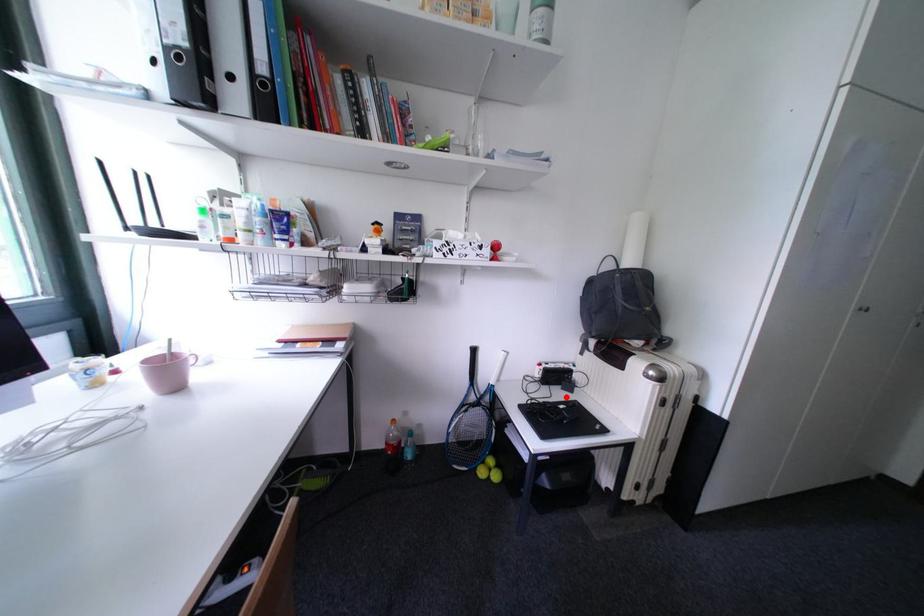
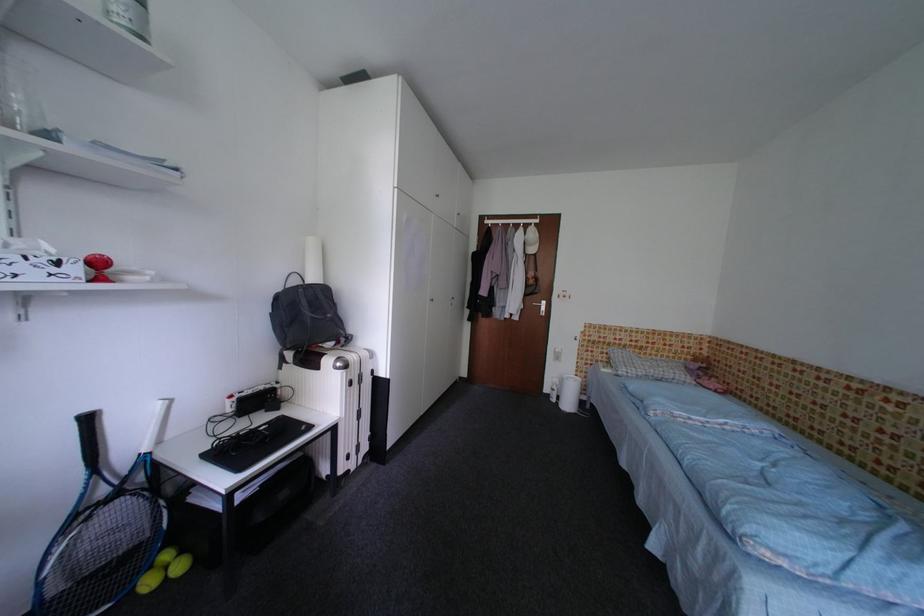
Locate, in the second image, the point that corresponds to the highlighted location in the first image.

(270, 421)